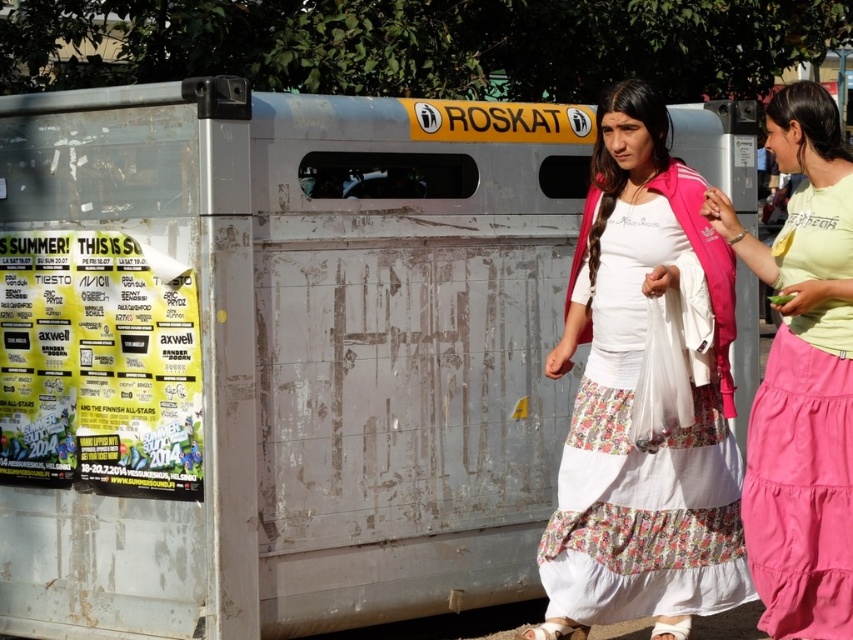
Is white cotton dress at center to the left of light green cotton shirt at right from the viewer's perspective?

Yes, white cotton dress at center is to the left of light green cotton shirt at right.

Does white cotton dress at center come in front of light green cotton shirt at right?

No, it is not.

The height and width of the screenshot is (640, 853). What are the coordinates of `white cotton dress at center` in the screenshot? It's located at (631, 397).

The height and width of the screenshot is (640, 853). I want to click on white cotton dress at center, so click(631, 397).